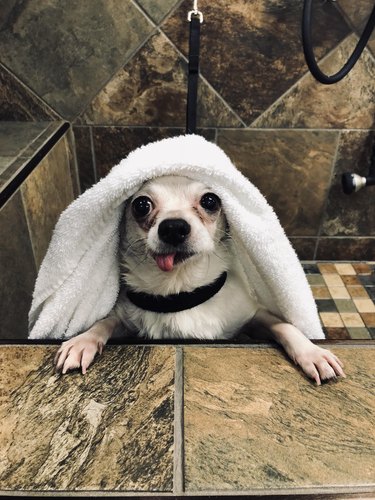
Locate an element on the screen. The image size is (375, 500). white towel is located at coordinates (202, 149).